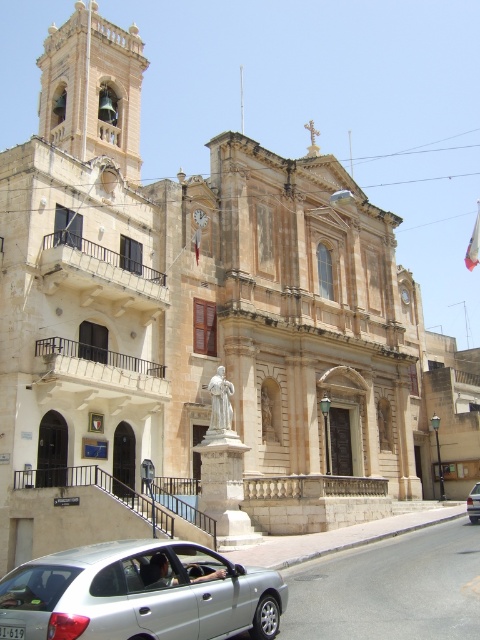
Question: Does silver metallic hatchback at lower left appear on the left side of silver metallic car at lower right?

Choices:
 (A) no
 (B) yes

Answer: (B)

Question: Can you confirm if silver metallic hatchback at lower left is thinner than silver metallic car at lower right?

Choices:
 (A) no
 (B) yes

Answer: (A)

Question: Which of the following is the farthest from the observer?

Choices:
 (A) (282, 589)
 (B) (469, 513)

Answer: (B)

Question: Among these points, which one is nearest to the camera?

Choices:
 (A) (148, 564)
 (B) (468, 496)

Answer: (A)

Question: Does silver metallic hatchback at lower left have a smaller size compared to silver metallic car at lower right?

Choices:
 (A) yes
 (B) no

Answer: (B)